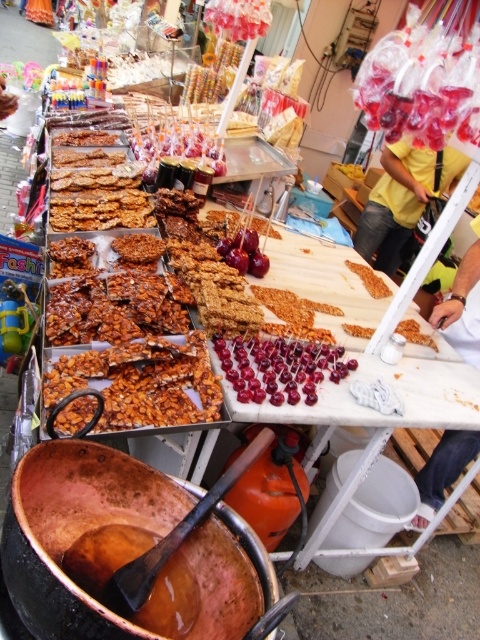
You are a customer at the stall and want to know which item is bigger between the yellow cotton shirt at upper right and the shiny red cherries at center. Can you tell me?

The yellow cotton shirt at upper right is larger in size than the shiny red cherries at center.

You are a customer at the food stall and want to grab both the yellow cotton shirt at upper right and the shiny red cherries at center. Given that you can only reach 6 feet, can you reach both items without moving?

The yellow cotton shirt at upper right and the shiny red cherries at center are 7.80 feet apart, which is beyond your 6 feet reach. Therefore, you cannot reach both items without moving.